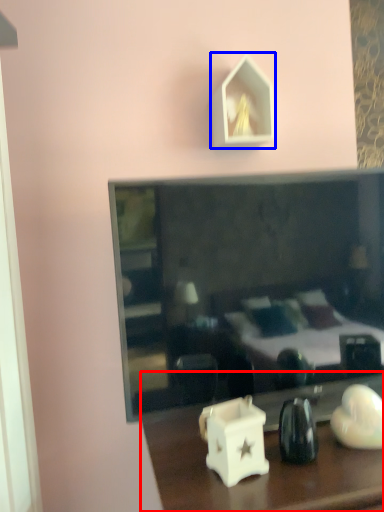
Question: Among these objects, which one is farthest to the camera, table (highlighted by a red box) or picture frame (highlighted by a blue box)?

Choices:
 (A) table
 (B) picture frame

Answer: (B)